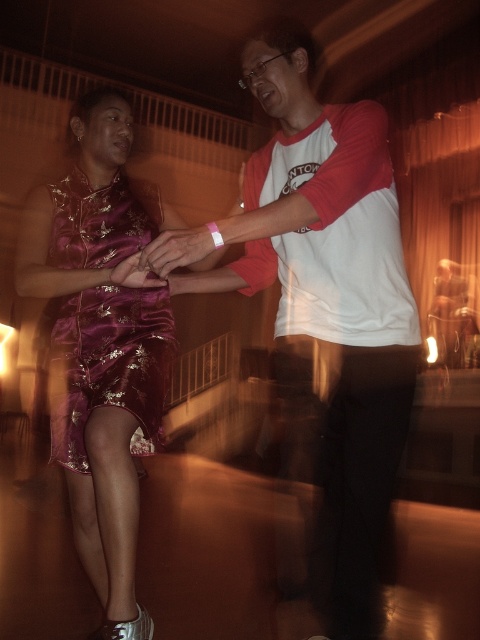
You are a photographer at a social event. You need to capture a photo of both the shiny purple dress at left and the satin purple dress at center. Considering their sizes, which dress will appear wider in the photo?

The shiny purple dress at left will appear wider in the photo because its width surpasses that of the satin purple dress at center.